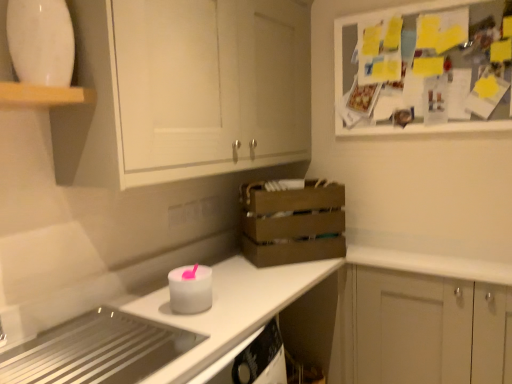
I want to click on white glossy countertop at lower left, so click(230, 309).

Identify the location of brown wooden crate at center. (292, 221).

Describe the element at coordinates (292, 221) in the screenshot. I see `brown wooden crate at center` at that location.

Find the location of a particular element. This screenshot has width=512, height=384. white matte cabinet at lower right, which is the first cabinetry from bottom to top is located at coordinates (419, 329).

In the scene shown: In terms of width, does white matte cabinet at lower right, which is the first cabinetry in right-to-left order, look wider or thinner when compared to brown wooden crate at center?

Considering their sizes, white matte cabinet at lower right, which is the first cabinetry in right-to-left order, looks slimmer than brown wooden crate at center.

Looking at this image, is white matte cabinet at lower right, which is the first cabinetry from bottom to top, further to the viewer compared to brown wooden crate at center?

No, white matte cabinet at lower right, which is the first cabinetry from bottom to top, is in front of brown wooden crate at center.

Is there a large distance between white matte cabinet at lower right, which is the first cabinetry in right-to-left order, and brown wooden crate at center?

Actually, white matte cabinet at lower right, which is the first cabinetry in right-to-left order, and brown wooden crate at center are a little close together.

Is white matte cabinet at lower right, which appears as the second cabinetry when viewed from the left, facing towards brown wooden crate at center?

No, white matte cabinet at lower right, which appears as the second cabinetry when viewed from the left, is not aimed at brown wooden crate at center.

Measure the distance between white matte candle at center, placed as the 2th appliance when sorted from top to bottom, and white glossy plate at upper left, the 3th appliance ordered from the bottom.

white matte candle at center, placed as the 2th appliance when sorted from top to bottom, and white glossy plate at upper left, the 3th appliance ordered from the bottom, are 31.31 inches apart from each other.

Visually, is white matte candle at center, placed as the 2th appliance when sorted from top to bottom, positioned to the left or to the right of white glossy plate at upper left, the 3th appliance ordered from the bottom?

From the image, it's evident that white matte candle at center, placed as the 2th appliance when sorted from top to bottom, is to the right of white glossy plate at upper left, the 3th appliance ordered from the bottom.

Is white matte candle at center, placed as the 2th appliance when sorted from top to bottom, not near white glossy plate at upper left, marked as the 1th appliance in a top-to-bottom arrangement?

No.

Based on the photo, looking at the image, does white matte candle at center, placed as the 2th appliance when sorted from top to bottom, seem bigger or smaller compared to white glossy plate at upper left, the 3th appliance ordered from the bottom?

white matte candle at center, placed as the 2th appliance when sorted from top to bottom, is smaller than white glossy plate at upper left, the 3th appliance ordered from the bottom.

Is metallic stainless steel cooktop at lower left, acting as the 3th appliance starting from the top, to the right of white glossy countertop at lower left from the viewer's perspective?

No, metallic stainless steel cooktop at lower left, acting as the 3th appliance starting from the top, is not to the right of white glossy countertop at lower left.

From the image's perspective, which one is positioned higher, metallic stainless steel cooktop at lower left, the first appliance when ordered from bottom to top, or white glossy countertop at lower left?

metallic stainless steel cooktop at lower left, the first appliance when ordered from bottom to top, from the image's perspective.

From a real-world perspective, who is located higher, metallic stainless steel cooktop at lower left, the first appliance when ordered from bottom to top, or white glossy countertop at lower left?

In real-world perspective, metallic stainless steel cooktop at lower left, the first appliance when ordered from bottom to top, is above.

Looking at the image, does metallic stainless steel cooktop at lower left, the first appliance when ordered from bottom to top, seem bigger or smaller compared to white glossy countertop at lower left?

metallic stainless steel cooktop at lower left, the first appliance when ordered from bottom to top, is smaller than white glossy countertop at lower left.

Between brown wooden crate at center and metallic stainless steel cooktop at lower left, acting as the 3th appliance starting from the top, which one has more height?

brown wooden crate at center is taller.

Is brown wooden crate at center wider than metallic stainless steel cooktop at lower left, the first appliance when ordered from bottom to top?

No, brown wooden crate at center is not wider than metallic stainless steel cooktop at lower left, the first appliance when ordered from bottom to top.

Considering the positions of objects brown wooden crate at center and metallic stainless steel cooktop at lower left, the first appliance when ordered from bottom to top, in the image provided, who is more to the right, brown wooden crate at center or metallic stainless steel cooktop at lower left, the first appliance when ordered from bottom to top,?

Positioned to the right is brown wooden crate at center.

The width and height of the screenshot is (512, 384). Find the location of `crate located on the right of metallic stainless steel cooktop at lower left, the first appliance when ordered from bottom to top`. crate located on the right of metallic stainless steel cooktop at lower left, the first appliance when ordered from bottom to top is located at coordinates (292, 221).

In terms of size, does white matte cabinet at upper left, the 1th cabinetry viewed from the left, appear bigger or smaller than metallic stainless steel cooktop at lower left, acting as the 3th appliance starting from the top?

In the image, white matte cabinet at upper left, the 1th cabinetry viewed from the left, appears to be larger than metallic stainless steel cooktop at lower left, acting as the 3th appliance starting from the top.

Is point (160, 72) less distant than point (36, 350)?

That is True.

From the image's perspective, count 3rd appliances downward from the white matte cabinet at upper left, placed as the second cabinetry when sorted from right to left, and point to it. Please provide its 2D coordinates.

[(97, 350)]

Which object is closer to the camera, white matte cabinet at upper left, the 2th cabinetry from the bottom, or metallic stainless steel cooktop at lower left, acting as the 3th appliance starting from the top?

Positioned in front is metallic stainless steel cooktop at lower left, acting as the 3th appliance starting from the top.

Is white matte cabinet at upper left, the 1th cabinetry from the top, positioned before white glossy plate at upper left, marked as the 1th appliance in a top-to-bottom arrangement?

Yes.

Does point (202, 85) come closer to viewer compared to point (12, 7)?

No, (202, 85) is behind (12, 7).

Is white matte cabinet at upper left, the 1th cabinetry viewed from the left, wider than white glossy plate at upper left, the 3th appliance ordered from the bottom?

Yes, white matte cabinet at upper left, the 1th cabinetry viewed from the left, is wider than white glossy plate at upper left, the 3th appliance ordered from the bottom.

Considering the relative positions of white matte cabinet at upper left, placed as the second cabinetry when sorted from right to left, and white glossy plate at upper left, marked as the 1th appliance in a top-to-bottom arrangement, in the image provided, is white matte cabinet at upper left, placed as the second cabinetry when sorted from right to left, to the left of white glossy plate at upper left, marked as the 1th appliance in a top-to-bottom arrangement, from the viewer's perspective?

No, white matte cabinet at upper left, placed as the second cabinetry when sorted from right to left, is not to the left of white glossy plate at upper left, marked as the 1th appliance in a top-to-bottom arrangement.

Does white glossy countertop at lower left have a lesser height compared to white matte cabinet at upper left, the 1th cabinetry viewed from the left?

Yes.

Consider the image. Would you say white matte cabinet at upper left, the 1th cabinetry viewed from the left, is part of white glossy countertop at lower left's contents?

No, white glossy countertop at lower left does not contain white matte cabinet at upper left, the 1th cabinetry viewed from the left.

Is white glossy countertop at lower left wider or thinner than white matte cabinet at upper left, the 1th cabinetry viewed from the left?

white glossy countertop at lower left is wider than white matte cabinet at upper left, the 1th cabinetry viewed from the left.

From the image's perspective, is white glossy countertop at lower left on white matte cabinet at upper left, the 1th cabinetry viewed from the left?

Actually, white glossy countertop at lower left appears below white matte cabinet at upper left, the 1th cabinetry viewed from the left, in the image.

Where is `crate that appears on the left of white matte cabinet at lower right, which appears as the second cabinetry when viewed from the left`? crate that appears on the left of white matte cabinet at lower right, which appears as the second cabinetry when viewed from the left is located at coordinates (292, 221).

You are a GUI agent. You are given a task and a screenshot of the screen. Output one action in this format:
    pyautogui.click(x=<x>, y=<y>)
    Task: Click on the appliance that appears above the white matte candle at center, the 2th appliance ordered from the bottom (from the image's perspective)
    The height and width of the screenshot is (384, 512).
    Given the screenshot: What is the action you would take?
    pyautogui.click(x=41, y=41)

From the image, which object appears to be nearer to white matte candle at center, the 2th appliance ordered from the bottom, brown wooden crate at center or white matte cabinet at lower right, which appears as the second cabinetry when viewed from the left?

brown wooden crate at center lies closer to white matte candle at center, the 2th appliance ordered from the bottom, than the other object.

From the image, which object appears to be farther from brown wooden crate at center, white glossy countertop at lower left or white matte cabinet at lower right, arranged as the second cabinetry when viewed from the top?

Based on the image, white matte cabinet at lower right, arranged as the second cabinetry when viewed from the top, appears to be further to brown wooden crate at center.

From the image, which object appears to be nearer to metallic stainless steel cooktop at lower left, the first appliance when ordered from bottom to top, brown wooden crate at center or white matte candle at center, the 2th appliance ordered from the bottom?

white matte candle at center, the 2th appliance ordered from the bottom, is closer to metallic stainless steel cooktop at lower left, the first appliance when ordered from bottom to top.

From the image, which object appears to be farther from metallic stainless steel cooktop at lower left, acting as the 3th appliance starting from the top, white glossy countertop at lower left or white glossy plate at upper left, the 3th appliance ordered from the bottom?

white glossy plate at upper left, the 3th appliance ordered from the bottom.

Considering their positions, is white matte cabinet at upper left, the 1th cabinetry viewed from the left, positioned further to white glossy plate at upper left, marked as the 1th appliance in a top-to-bottom arrangement, than white glossy countertop at lower left?

white glossy countertop at lower left is positioned further to the anchor white glossy plate at upper left, marked as the 1th appliance in a top-to-bottom arrangement.

Considering their positions, is white matte candle at center, the 2th appliance ordered from the bottom, positioned further to white glossy countertop at lower left than brown wooden crate at center?

brown wooden crate at center.

Considering their positions, is white matte cabinet at lower right, arranged as the second cabinetry when viewed from the top, positioned further to white matte cabinet at upper left, the 1th cabinetry from the top, than white matte candle at center, placed as the 2th appliance when sorted from top to bottom?

Based on the image, white matte cabinet at lower right, arranged as the second cabinetry when viewed from the top, appears to be further to white matte cabinet at upper left, the 1th cabinetry from the top.

Estimate the real-world distances between objects in this image. Which object is closer to white matte cabinet at upper left, placed as the second cabinetry when sorted from right to left, white glossy plate at upper left, marked as the 1th appliance in a top-to-bottom arrangement, or brown wooden crate at center?

brown wooden crate at center is positioned closer to the anchor white matte cabinet at upper left, placed as the second cabinetry when sorted from right to left.

You are a GUI agent. You are given a task and a screenshot of the screen. Output one action in this format:
    pyautogui.click(x=<x>, y=<y>)
    Task: Click on the crate that lies between white matte cabinet at upper left, the 1th cabinetry from the top, and metallic stainless steel cooktop at lower left, acting as the 3th appliance starting from the top, from top to bottom
    Image resolution: width=512 pixels, height=384 pixels.
    Given the screenshot: What is the action you would take?
    coord(292,221)

At what (x,y) coordinates should I click in order to perform the action: click on appliance between white glossy plate at upper left, marked as the 1th appliance in a top-to-bottom arrangement, and metallic stainless steel cooktop at lower left, acting as the 3th appliance starting from the top, vertically. Please return your answer as a coordinate pair (x, y). This screenshot has width=512, height=384. Looking at the image, I should click on (190, 289).

Image resolution: width=512 pixels, height=384 pixels. Identify the location of crate between white matte cabinet at upper left, the 1th cabinetry viewed from the left, and white glossy countertop at lower left from top to bottom. (292, 221).

Find the location of a particular element. The height and width of the screenshot is (384, 512). crate between white matte cabinet at upper left, the 2th cabinetry from the bottom, and white matte cabinet at lower right, arranged as the second cabinetry when viewed from the top, vertically is located at coordinates (292, 221).